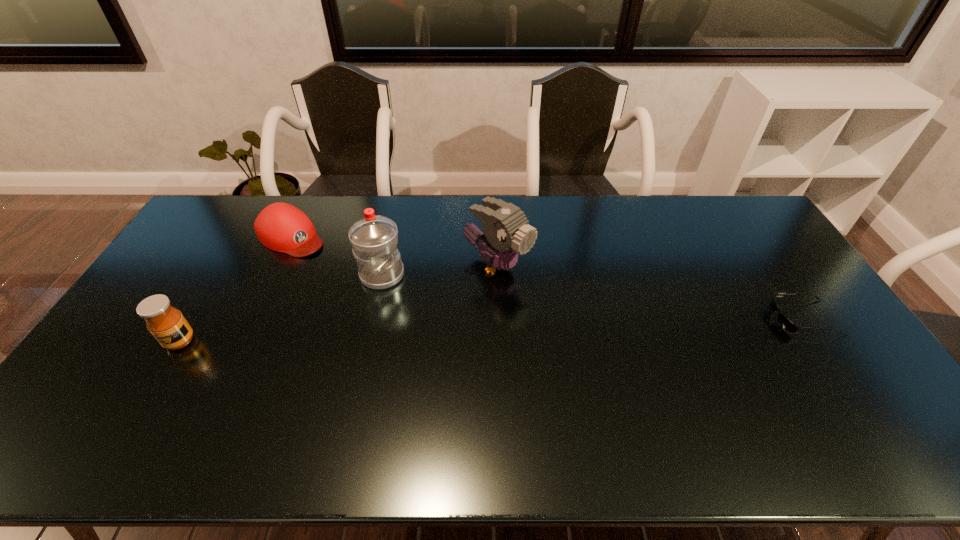
At what (x,y) coordinates should I click in order to perform the action: click on free space on the desktop that is between the third tallest object and the rightmost object and is positioned on the handle side of the water bottle. Please return your answer as a coordinate pair (x, y). This screenshot has height=540, width=960. Looking at the image, I should click on click(x=501, y=329).

Where is `vacant space on the desktop that is between the third tallest object and the sunglasses and is positioned on the front-facing side of the fourth tallest object`? vacant space on the desktop that is between the third tallest object and the sunglasses and is positioned on the front-facing side of the fourth tallest object is located at coordinates (432, 332).

I want to click on vacant space on the desktop that is between the leftmost object and the shortest object and is positioned at the beak of the fourth object from left to right, so click(x=588, y=326).